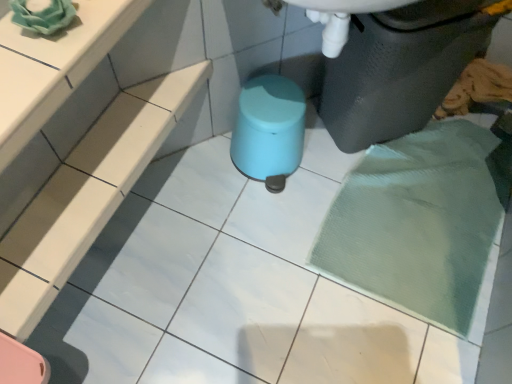
Question: From a real-world perspective, is matte plastic waste container at lower right positioned above or below mint glossy stool at center?

Choices:
 (A) below
 (B) above

Answer: (B)

Question: Is point coord(352,23) positioned closer to the camera than point coord(263,165)?

Choices:
 (A) farther
 (B) closer

Answer: (B)

Question: From the image's perspective, relative to mint glossy stool at center, is matte plastic waste container at lower right above or below?

Choices:
 (A) below
 (B) above

Answer: (B)

Question: Is point (271, 100) positioned closer to the camera than point (467, 54)?

Choices:
 (A) closer
 (B) farther

Answer: (B)

Question: Which is correct: mint glossy stool at center is inside matte plastic waste container at lower right, or outside of it?

Choices:
 (A) outside
 (B) inside

Answer: (A)

Question: From a real-world perspective, relative to matte plastic waste container at lower right, is mint glossy stool at center vertically above or below?

Choices:
 (A) below
 (B) above

Answer: (A)

Question: In the image, is mint glossy stool at center on the left side or the right side of matte plastic waste container at lower right?

Choices:
 (A) left
 (B) right

Answer: (A)